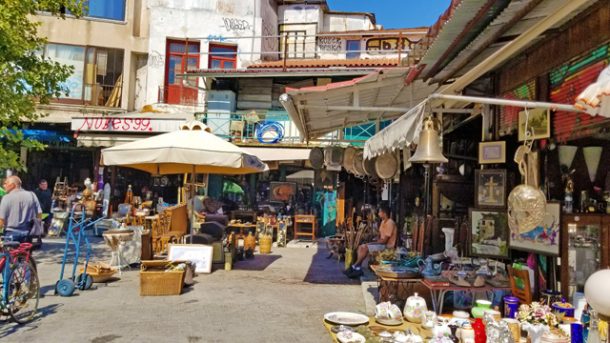
Locate an element on the screen. basket is located at coordinates (170, 279).